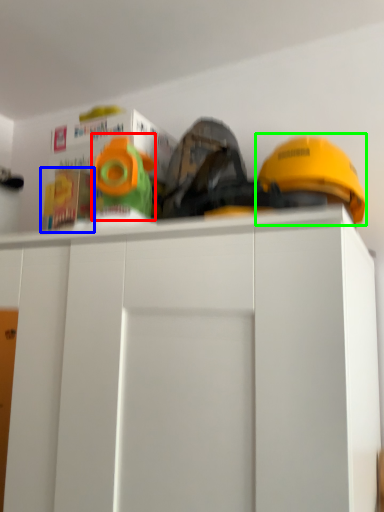
Question: Estimate the real-world distances between objects in this image. Which object is closer to toy (highlighted by a red box), toy (highlighted by a blue box) or helmet (highlighted by a green box)?

Choices:
 (A) toy
 (B) helmet

Answer: (A)